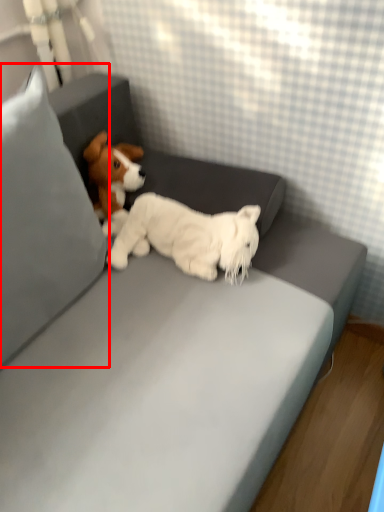
Question: In this image, where is pillow (annotated by the red box) located relative to dog?

Choices:
 (A) left
 (B) right

Answer: (A)